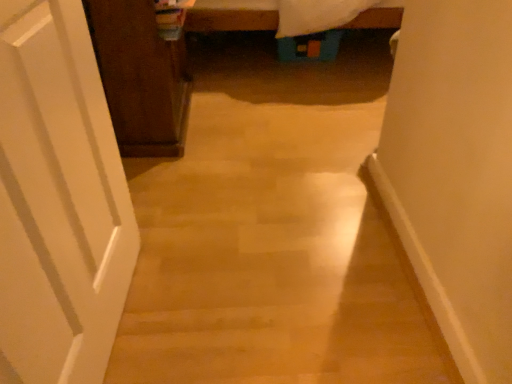
Question: Is dark wood cabinet at left bigger or smaller than white matte door at left?

Choices:
 (A) small
 (B) big

Answer: (B)

Question: From a real-world perspective, relative to white matte door at left, is dark wood cabinet at left vertically above or below?

Choices:
 (A) above
 (B) below

Answer: (B)

Question: From the image's perspective, is dark wood cabinet at left above or below white matte door at left?

Choices:
 (A) above
 (B) below

Answer: (A)

Question: From the image's perspective, is white matte door at left positioned above or below dark wood cabinet at left?

Choices:
 (A) below
 (B) above

Answer: (A)

Question: From a real-world perspective, is white matte door at left positioned above or below dark wood cabinet at left?

Choices:
 (A) below
 (B) above

Answer: (B)

Question: Considering the positions of point (69, 19) and point (151, 21), is point (69, 19) closer or farther from the camera than point (151, 21)?

Choices:
 (A) farther
 (B) closer

Answer: (B)

Question: Relative to dark wood cabinet at left, is white matte door at left in front or behind?

Choices:
 (A) behind
 (B) front

Answer: (B)